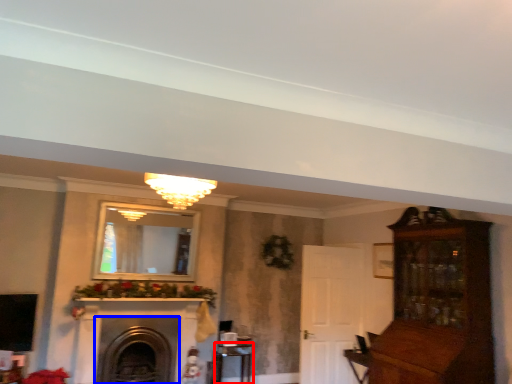
Question: Which object is closer to the camera taking this photo, table (highlighted by a red box) or fireplace (highlighted by a blue box)?

Choices:
 (A) table
 (B) fireplace

Answer: (B)